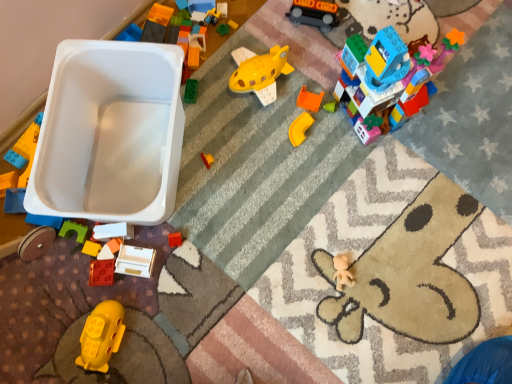
You are a GUI agent. You are given a task and a screenshot of the screen. Output one action in this format:
    pyautogui.click(x=<x>, y=<y>)
    Task: Click on the free space that is in between white plastic toy car at upper left and matte white drawer at lower center, positioned as the 4th toy in right-to-left order
    This screenshot has width=512, height=384.
    Given the screenshot: What is the action you would take?
    pyautogui.click(x=126, y=247)